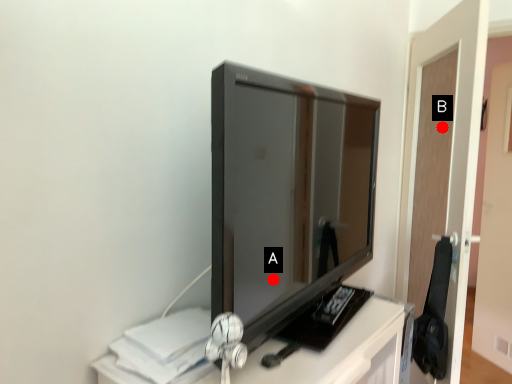
Question: Two points are circled on the image, labeled by A and B beside each circle. Which point is closer to the camera taking this photo?

Choices:
 (A) A is closer
 (B) B is closer

Answer: (B)